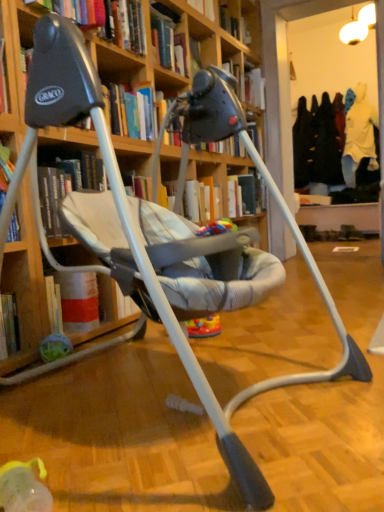
Question: Is multicolored plastic toy at center taller or shorter than hardcover book at upper center, marked as the 1th book in a bottom-to-top arrangement?

Choices:
 (A) tall
 (B) short

Answer: (B)

Question: Does point (205, 231) appear closer or farther from the camera than point (162, 117)?

Choices:
 (A) farther
 (B) closer

Answer: (B)

Question: Which object is the closest to the wooden bookcase at center?

Choices:
 (A) multicolored plastic toy at center
 (B) hardcover book at upper center, placed as the third book when sorted from back to front
 (C) hardcover book at upper center, acting as the third book starting from the bottom
 (D) hardcover book at upper center, marked as the 1th book in a bottom-to-top arrangement

Answer: (A)

Question: Considering the real-world distances, which object is farthest from the hardcover book at upper center, arranged as the second book when viewed from the right?

Choices:
 (A) wooden bookcase at center
 (B) multicolored plastic toy at center
 (C) hardcover book at upper center, which is the first book in top-to-bottom order
 (D) hardcover book at upper center, placed as the third book when sorted from back to front

Answer: (C)